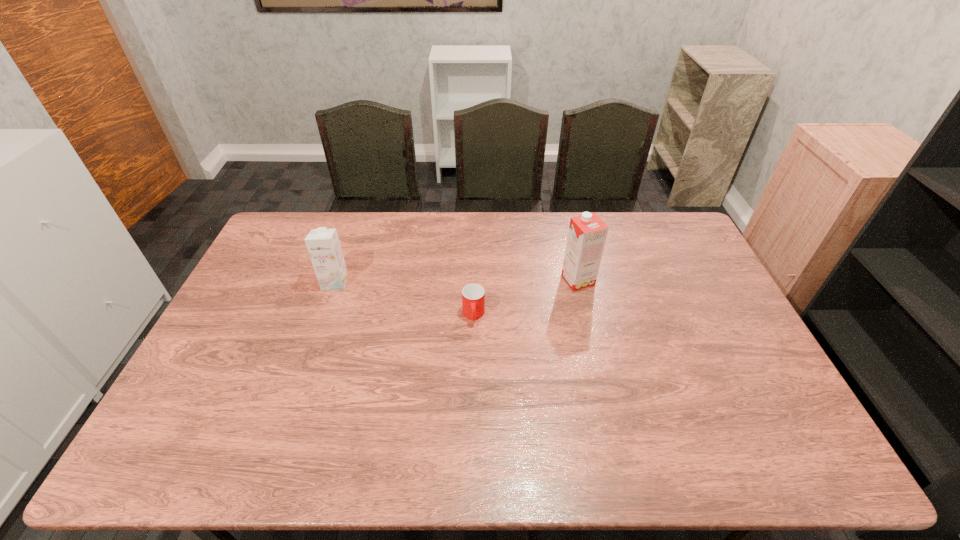
Identify the location of empty space between the shorter carton and the nearest object. The height and width of the screenshot is (540, 960). (404, 299).

The width and height of the screenshot is (960, 540). In order to click on vacant area that lies between the cup and the tallest object in this screenshot , I will do `click(526, 298)`.

This screenshot has width=960, height=540. I want to click on unoccupied area between the shorter carton and the nearest object, so (x=404, y=299).

Where is `empty location between the taller carton and the second object from left to right`? The image size is (960, 540). empty location between the taller carton and the second object from left to right is located at coordinates (526, 298).

Find the location of a particular element. This screenshot has width=960, height=540. vacant point located between the right carton and the second tallest object is located at coordinates (456, 281).

Identify which object is the second closest to the second tallest object. Please provide its 2D coordinates. Your answer should be formatted as a tuple, i.e. [(x, y)], where the tuple contains the x and y coordinates of a point satisfying the conditions above.

[(587, 234)]

Identify the location of the closest object to the cup. This screenshot has width=960, height=540. pos(587,234).